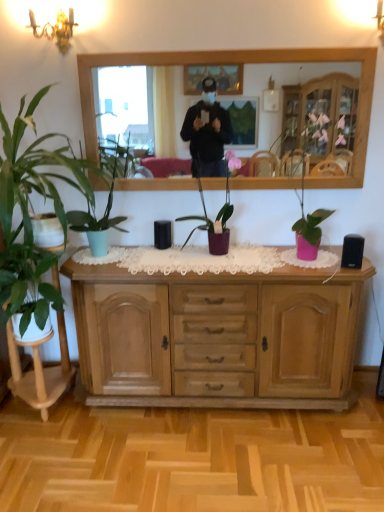
What do you see at coordinates (122, 103) in the screenshot?
I see `wooden mirror at upper center` at bounding box center [122, 103].

Find the location of a particular element. This screenshot has height=512, width=384. light brown wood cabinet at center is located at coordinates (217, 337).

The image size is (384, 512). I want to click on green matte plant at left, acting as the 3th houseplant starting from the left, so click(97, 221).

Locate an element on the screen. Image resolution: width=384 pixels, height=512 pixels. green glossy plant at left, which is counted as the first houseplant, starting from the left is located at coordinates (27, 284).

This screenshot has width=384, height=512. I want to click on wooden mirror at upper center, so click(122, 103).

From a real-world perspective, is light brown wood cabinet at center positioned above or below purple matte plant at center, placed as the fourth houseplant when sorted from left to right?

Clearly, from a real-world perspective, light brown wood cabinet at center is below purple matte plant at center, placed as the fourth houseplant when sorted from left to right.

Based on the photo, from the image's perspective, relative to purple matte plant at center, placed as the fourth houseplant when sorted from left to right, is light brown wood cabinet at center above or below?

Clearly, from the image's perspective, light brown wood cabinet at center is below purple matte plant at center, placed as the fourth houseplant when sorted from left to right.

Considering the relative sizes of light brown wood cabinet at center and purple matte plant at center, placed as the 1th houseplant when sorted from right to left, in the image provided, is light brown wood cabinet at center thinner than purple matte plant at center, placed as the 1th houseplant when sorted from right to left,?

No.

In the scene shown: In the image, is light brown wood cabinet at center on the left side or the right side of purple matte plant at center, placed as the 1th houseplant when sorted from right to left?

light brown wood cabinet at center is positioned on purple matte plant at center, placed as the 1th houseplant when sorted from right to left,'s right side.

Is point (49, 186) farther from viewer compared to point (101, 100)?

No, it is in front of (101, 100).

From the image's perspective, is green matte plant at left, marked as the third houseplant in a right-to-left arrangement, positioned above or below wooden mirror at upper center?

green matte plant at left, marked as the third houseplant in a right-to-left arrangement, is situated lower than wooden mirror at upper center in the image.

Is green matte plant at left, the 2th houseplant positioned from the left, turned away from wooden mirror at upper center?

No, green matte plant at left, the 2th houseplant positioned from the left, is not facing the opposite direction of wooden mirror at upper center.

Which of these two, green matte plant at left, the 2th houseplant positioned from the left, or wooden mirror at upper center, is bigger?

Bigger between the two is green matte plant at left, the 2th houseplant positioned from the left.

Is purple matte plant at center, placed as the 1th houseplant when sorted from right to left, located within green matte plant at left, marked as the third houseplant in a right-to-left arrangement?

Actually, purple matte plant at center, placed as the 1th houseplant when sorted from right to left, is outside green matte plant at left, marked as the third houseplant in a right-to-left arrangement.

Who is smaller, green matte plant at left, marked as the third houseplant in a right-to-left arrangement, or purple matte plant at center, placed as the fourth houseplant when sorted from left to right?

Smaller between the two is purple matte plant at center, placed as the fourth houseplant when sorted from left to right.

Identify the location of the 3rd houseplant behind the green matte plant at left, marked as the third houseplant in a right-to-left arrangement. The width and height of the screenshot is (384, 512). (216, 216).

From the image's perspective, is green glossy plant at left, which is the 4th houseplant from right to left, over green matte plant at left, the 2th houseplant positioned from the left?

No, from the image's perspective, green glossy plant at left, which is the 4th houseplant from right to left, is not over green matte plant at left, the 2th houseplant positioned from the left.

Is green matte plant at left, marked as the third houseplant in a right-to-left arrangement, located within green glossy plant at left, which is counted as the first houseplant, starting from the left?

No, green matte plant at left, marked as the third houseplant in a right-to-left arrangement, is not surrounded by green glossy plant at left, which is counted as the first houseplant, starting from the left.

Which object is further away from the camera taking this photo, green glossy plant at left, which is counted as the first houseplant, starting from the left, or green matte plant at left, marked as the third houseplant in a right-to-left arrangement?

Positioned behind is green glossy plant at left, which is counted as the first houseplant, starting from the left.

Which object is positioned more to the right, green glossy plant at left, which is counted as the first houseplant, starting from the left, or green matte plant at left, the 2th houseplant positioned from the left?

green matte plant at left, the 2th houseplant positioned from the left, is more to the right.

From a real-world perspective, relative to light brown wood cabinet at center, is purple matte plant at center, placed as the 1th houseplant when sorted from right to left, vertically above or below?

purple matte plant at center, placed as the 1th houseplant when sorted from right to left, is above light brown wood cabinet at center.

Considering the sizes of objects purple matte plant at center, placed as the 1th houseplant when sorted from right to left, and light brown wood cabinet at center in the image provided, who is wider, purple matte plant at center, placed as the 1th houseplant when sorted from right to left, or light brown wood cabinet at center?

With larger width is light brown wood cabinet at center.

From the image's perspective, which is below, purple matte plant at center, placed as the fourth houseplant when sorted from left to right, or light brown wood cabinet at center?

light brown wood cabinet at center is shown below in the image.

From the picture: Can we say purple matte plant at center, placed as the fourth houseplant when sorted from left to right, lies outside light brown wood cabinet at center?

Indeed, purple matte plant at center, placed as the fourth houseplant when sorted from left to right, is completely outside light brown wood cabinet at center.

Between light brown wood cabinet at center and wooden mirror at upper center, which one has larger width?

With larger width is light brown wood cabinet at center.

From a real-world perspective, which is physically above, light brown wood cabinet at center or wooden mirror at upper center?

From a 3D spatial view, wooden mirror at upper center is above.

In the scene shown: From the image's perspective, between light brown wood cabinet at center and wooden mirror at upper center, who is located below?

light brown wood cabinet at center.

How many degrees apart are the facing directions of light brown wood cabinet at center and wooden mirror at upper center?

0.00749 degrees separate the facing orientations of light brown wood cabinet at center and wooden mirror at upper center.

Measure the distance from purple matte plant at center, placed as the 1th houseplant when sorted from right to left, to green matte plant at left, acting as the 3th houseplant starting from the left.

purple matte plant at center, placed as the 1th houseplant when sorted from right to left, is 19.06 inches away from green matte plant at left, acting as the 3th houseplant starting from the left.

Is point (227, 167) behind point (97, 246)?

That is True.

Between purple matte plant at center, placed as the 1th houseplant when sorted from right to left, and green matte plant at left, marked as the 2th houseplant in a right-to-left arrangement, which one has less height?

With less height is purple matte plant at center, placed as the 1th houseplant when sorted from right to left.

At what (x,y) coordinates should I click in order to perform the action: click on cabinetry on the right of purple matte plant at center, placed as the 1th houseplant when sorted from right to left. Please return your answer as a coordinate pair (x, y). The width and height of the screenshot is (384, 512). Looking at the image, I should click on (217, 337).

Locate an element on the screen. mirror behind the green matte plant at left, the 2th houseplant positioned from the left is located at coordinates (122, 103).

Estimate the real-world distances between objects in this image. Which object is further from green matte plant at left, acting as the 3th houseplant starting from the left, green glossy plant at left, which is counted as the first houseplant, starting from the left, or light brown wood cabinet at center?

light brown wood cabinet at center is further to green matte plant at left, acting as the 3th houseplant starting from the left.

When comparing their distances from light brown wood cabinet at center, does wooden mirror at upper center or green matte plant at left, marked as the third houseplant in a right-to-left arrangement, seem further?

The object further to light brown wood cabinet at center is wooden mirror at upper center.

When comparing their distances from green matte plant at left, acting as the 3th houseplant starting from the left, does green glossy plant at left, which is the 4th houseplant from right to left, or purple matte plant at center, placed as the 1th houseplant when sorted from right to left, seem closer?

Among the two, green glossy plant at left, which is the 4th houseplant from right to left, is located nearer to green matte plant at left, acting as the 3th houseplant starting from the left.

Which object lies further to the anchor point green glossy plant at left, which is the 4th houseplant from right to left, wooden mirror at upper center or green matte plant at left, marked as the 2th houseplant in a right-to-left arrangement?

wooden mirror at upper center.

Looking at the image, which one is located closer to wooden mirror at upper center, green matte plant at left, acting as the 3th houseplant starting from the left, or green matte plant at left, the 2th houseplant positioned from the left?

Among the two, green matte plant at left, acting as the 3th houseplant starting from the left, is located nearer to wooden mirror at upper center.

Estimate the real-world distances between objects in this image. Which object is closer to light brown wood cabinet at center, green matte plant at left, marked as the 2th houseplant in a right-to-left arrangement, or purple matte plant at center, placed as the fourth houseplant when sorted from left to right?

The object closer to light brown wood cabinet at center is purple matte plant at center, placed as the fourth houseplant when sorted from left to right.

Which object lies further to the anchor point purple matte plant at center, placed as the 1th houseplant when sorted from right to left, green matte plant at left, acting as the 3th houseplant starting from the left, or green matte plant at left, the 2th houseplant positioned from the left?

green matte plant at left, the 2th houseplant positioned from the left, lies further to purple matte plant at center, placed as the 1th houseplant when sorted from right to left, than the other object.

When comparing their distances from purple matte plant at center, placed as the 1th houseplant when sorted from right to left, does light brown wood cabinet at center or green matte plant at left, marked as the 2th houseplant in a right-to-left arrangement, seem further?

light brown wood cabinet at center is positioned further to the anchor purple matte plant at center, placed as the 1th houseplant when sorted from right to left.

Where is `houseplant between green matte plant at left, the 2th houseplant positioned from the left, and purple matte plant at center, placed as the 1th houseplant when sorted from right to left`? houseplant between green matte plant at left, the 2th houseplant positioned from the left, and purple matte plant at center, placed as the 1th houseplant when sorted from right to left is located at coordinates (97, 221).

Find the location of `houseplant between green matte plant at left, acting as the 3th houseplant starting from the left, and wooden mirror at upper center from left to right`. houseplant between green matte plant at left, acting as the 3th houseplant starting from the left, and wooden mirror at upper center from left to right is located at coordinates (216, 216).